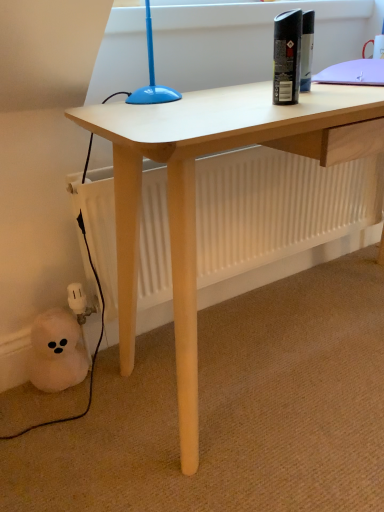
Question: Is black rubber cable at lower left to the left or to the right of black matte spray can at upper right in the image?

Choices:
 (A) right
 (B) left

Answer: (B)

Question: Considering the positions of black rubber cable at lower left and black matte spray can at upper right in the image, is black rubber cable at lower left taller or shorter than black matte spray can at upper right?

Choices:
 (A) tall
 (B) short

Answer: (A)

Question: Considering the positions of black rubber cable at lower left and black matte spray can at upper right in the image, is black rubber cable at lower left bigger or smaller than black matte spray can at upper right?

Choices:
 (A) small
 (B) big

Answer: (B)

Question: Would you say black matte spray can at upper right is inside or outside black rubber cable at lower left?

Choices:
 (A) inside
 (B) outside

Answer: (B)

Question: Considering the positions of black matte spray can at upper right and black rubber cable at lower left in the image, is black matte spray can at upper right taller or shorter than black rubber cable at lower left?

Choices:
 (A) tall
 (B) short

Answer: (B)

Question: Visually, is black matte spray can at upper right positioned to the left or to the right of black rubber cable at lower left?

Choices:
 (A) right
 (B) left

Answer: (A)

Question: Considering their positions, is black matte spray can at upper right located in front of or behind black rubber cable at lower left?

Choices:
 (A) behind
 (B) front

Answer: (B)